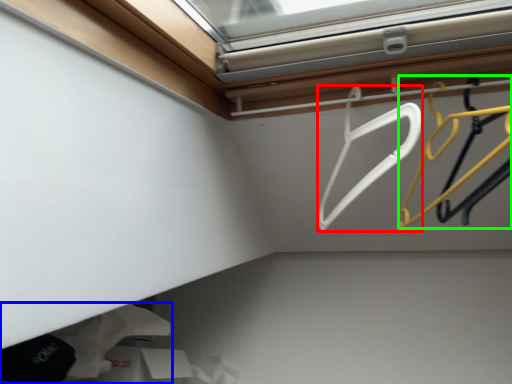
Question: Estimate the real-world distances between objects in this image. Which object is closer to hanger (highlighted by a red box), clothing (highlighted by a blue box) or hanger (highlighted by a green box)?

Choices:
 (A) clothing
 (B) hanger

Answer: (B)